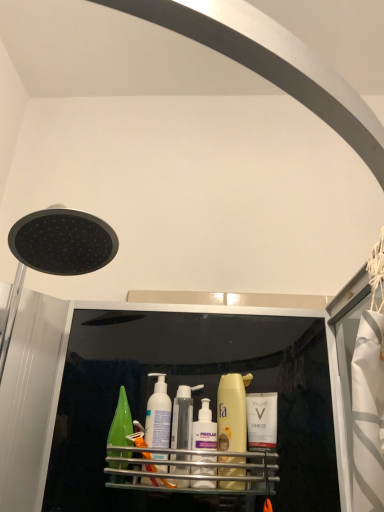
Question: Would you say translucent plastic bottles at center, the 3th toiletry in the right-to-left sequence, is inside or outside metallic silver shelf at center?

Choices:
 (A) inside
 (B) outside

Answer: (A)

Question: From a real-world perspective, is translucent plastic bottles at center, the 3th toiletry in the right-to-left sequence, above or below metallic silver shelf at center?

Choices:
 (A) above
 (B) below

Answer: (A)

Question: Based on their relative distances, which object is nearer to the metallic silver shelf at center?

Choices:
 (A) white matte pump bottle at center, the first cleaning product from the left
 (B) white matte vichy bottle at center, marked as the 3th toiletry in a left-to-right arrangement
 (C) white plastic pump bottle at center, marked as the 2th toiletry in a left-to-right arrangement
 (D) translucent plastic bottles at center, the 3th toiletry in the right-to-left sequence
 (E) black matte shower head at upper left

Answer: (C)

Question: Based on their relative distances, which object is nearer to the black matte shower head at upper left?

Choices:
 (A) translucent plastic bottles at center, placed as the first toiletry when sorted from left to right
 (B) matte yellow bottle at center, acting as the second cleaning product starting from the left
 (C) white matte pump bottle at center, the first cleaning product from the left
 (D) white plastic pump bottle at center, marked as the 2th toiletry in a left-to-right arrangement
 (E) white matte vichy bottle at center, the 1th toiletry in the right-to-left sequence

Answer: (C)